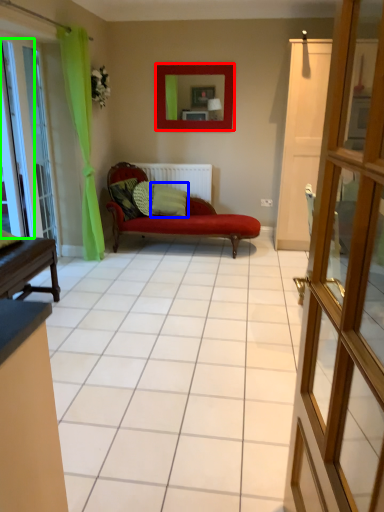
Question: Which is farther away from picture frame (highlighted by a red box)? pillow (highlighted by a blue box) or window (highlighted by a green box)?

Choices:
 (A) pillow
 (B) window

Answer: (B)